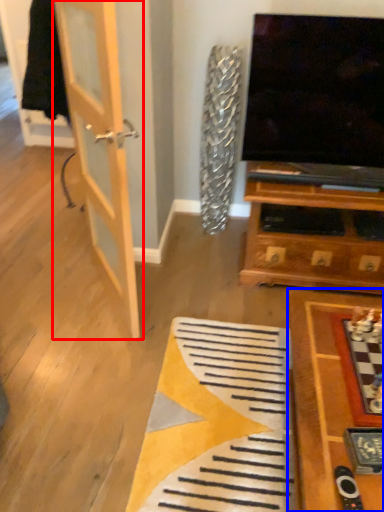
Question: Which object appears closest to the camera in this image, door (highlighted by a red box) or table (highlighted by a blue box)?

Choices:
 (A) door
 (B) table

Answer: (B)